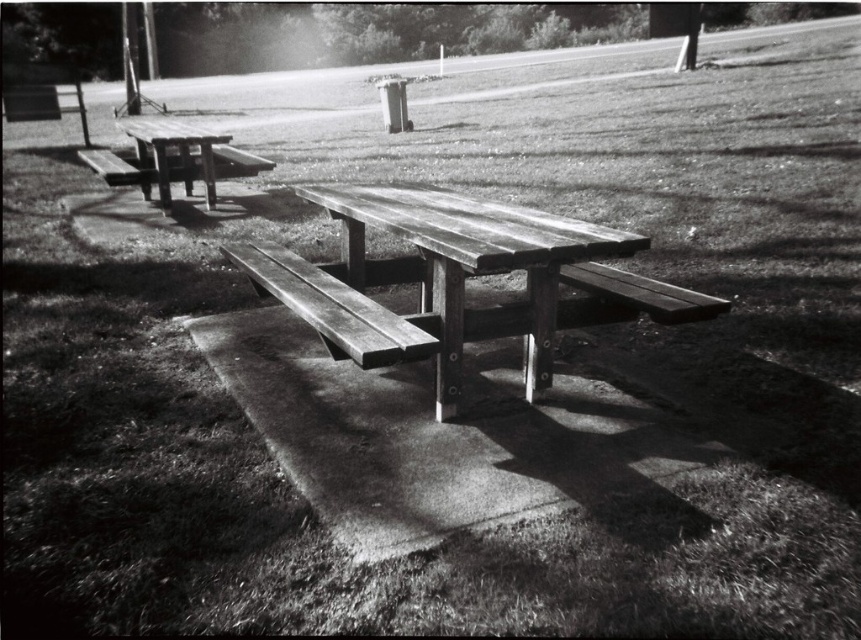
Which of these two, wooden bench at center or wooden picnic table at left, stands taller?

wooden bench at center

Between wooden bench at center and wooden picnic table at left, which one appears on the right side from the viewer's perspective?

wooden bench at center is more to the right.

Which is behind, point (375, 356) or point (175, 141)?

Point (175, 141)

Where is `wooden bench at center`? The image size is (861, 640). wooden bench at center is located at coordinates (332, 307).

In order to click on wooden picnic table at center in this screenshot , I will do `click(471, 260)`.

Measure the distance between wooden picnic table at center and camera.

wooden picnic table at center and camera are 7.96 feet apart.

Find the location of a particular element. wooden picnic table at center is located at coordinates (471, 260).

Is wooden picnic table at center wider than wooden bench at center?

Correct, the width of wooden picnic table at center exceeds that of wooden bench at center.

Which of these two, wooden picnic table at center or wooden bench at center, stands taller?

With more height is wooden picnic table at center.

Does point (345, 184) come behind point (276, 248)?

Yes, it is.

The width and height of the screenshot is (861, 640). What are the coordinates of `wooden picnic table at center` in the screenshot? It's located at (471, 260).